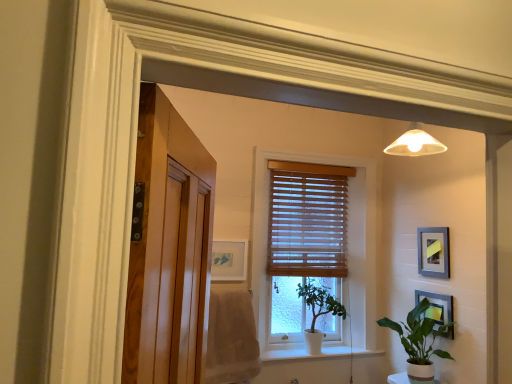
Question: From the image's perspective, does gray matte picture frame at upper right, which is the 1th picture frame in right-to-left order, appear higher than wooden blinds at center?

Choices:
 (A) yes
 (B) no

Answer: (B)

Question: Can you confirm if gray matte picture frame at upper right, which is the 1th picture frame in right-to-left order, is taller than wooden blinds at center?

Choices:
 (A) no
 (B) yes

Answer: (A)

Question: Does gray matte picture frame at upper right, marked as the third picture frame in a left-to-right arrangement, appear on the left side of wooden blinds at center?

Choices:
 (A) yes
 (B) no

Answer: (B)

Question: Is wooden blinds at center surrounded by gray matte picture frame at upper right, which is the 1th picture frame in right-to-left order?

Choices:
 (A) no
 (B) yes

Answer: (A)

Question: From a real-world perspective, is gray matte picture frame at upper right, marked as the third picture frame in a left-to-right arrangement, physically above wooden blinds at center?

Choices:
 (A) no
 (B) yes

Answer: (A)

Question: Is gray matte picture frame at upper right, marked as the third picture frame in a left-to-right arrangement, not near wooden blinds at center?

Choices:
 (A) yes
 (B) no

Answer: (B)

Question: Does metallic silver picture frame at lower right, the second picture frame when ordered from right to left, have a larger size compared to wooden blinds at center?

Choices:
 (A) no
 (B) yes

Answer: (A)

Question: Considering the relative positions of metallic silver picture frame at lower right, the second picture frame when ordered from right to left, and wooden blinds at center in the image provided, is metallic silver picture frame at lower right, the second picture frame when ordered from right to left, to the left of wooden blinds at center from the viewer's perspective?

Choices:
 (A) yes
 (B) no

Answer: (B)

Question: Is metallic silver picture frame at lower right, the 2th picture frame when ordered from left to right, facing away from wooden blinds at center?

Choices:
 (A) no
 (B) yes

Answer: (A)

Question: From the image's perspective, is metallic silver picture frame at lower right, the 2th picture frame when ordered from left to right, under wooden blinds at center?

Choices:
 (A) yes
 (B) no

Answer: (A)

Question: From a real-world perspective, does metallic silver picture frame at lower right, the 2th picture frame when ordered from left to right, sit lower than wooden blinds at center?

Choices:
 (A) yes
 (B) no

Answer: (A)

Question: Could you tell me if metallic silver picture frame at lower right, the second picture frame when ordered from right to left, is turned towards wooden blinds at center?

Choices:
 (A) no
 (B) yes

Answer: (A)

Question: From the image's perspective, does wooden blinds at center appear lower than matte white picture frame at center, the third picture frame positioned from the right?

Choices:
 (A) no
 (B) yes

Answer: (A)